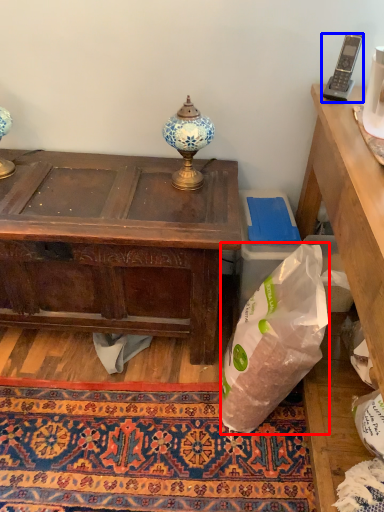
Question: Which of the following is the farthest to the observer, plastic bag (highlighted by a red box) or corded phone (highlighted by a blue box)?

Choices:
 (A) plastic bag
 (B) corded phone

Answer: (B)